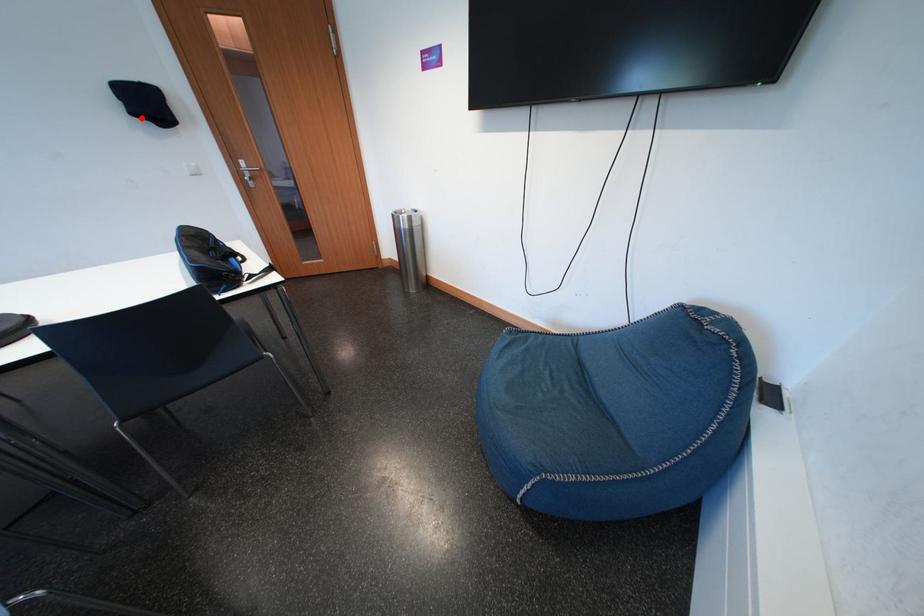
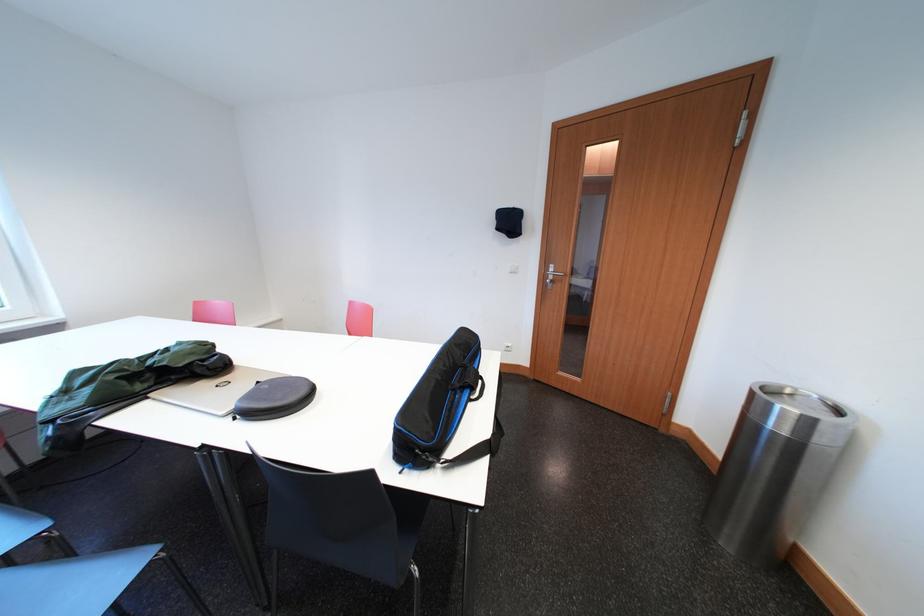
In the second image, find the point that corresponds to the highlighted location in the first image.

(506, 233)